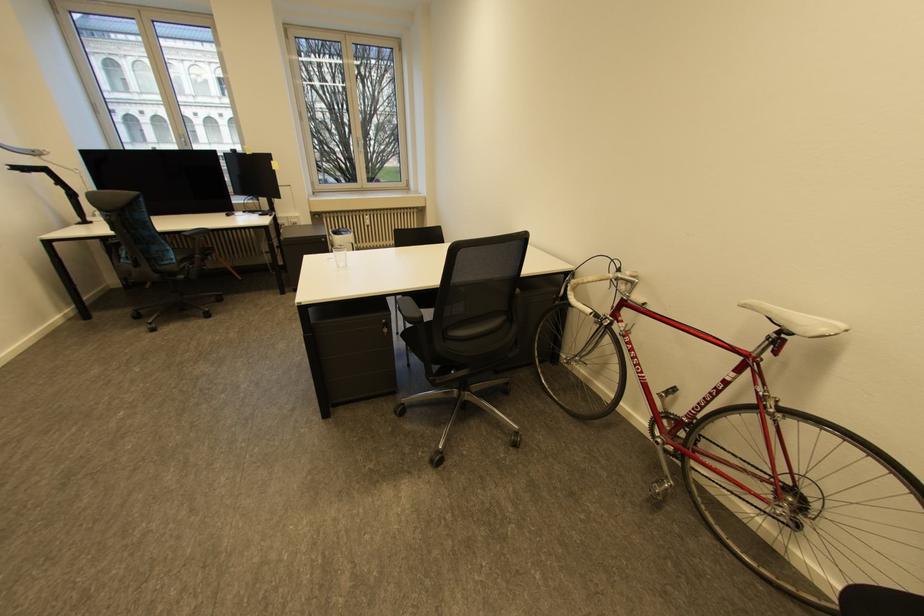
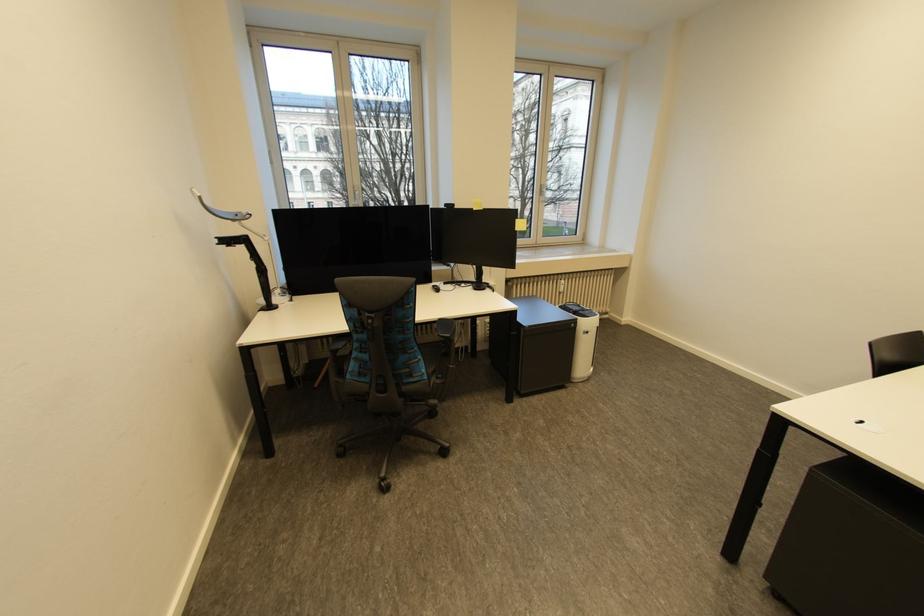
What movement of the cameraman would produce the second image?

The cameraman moved toward left, forward.